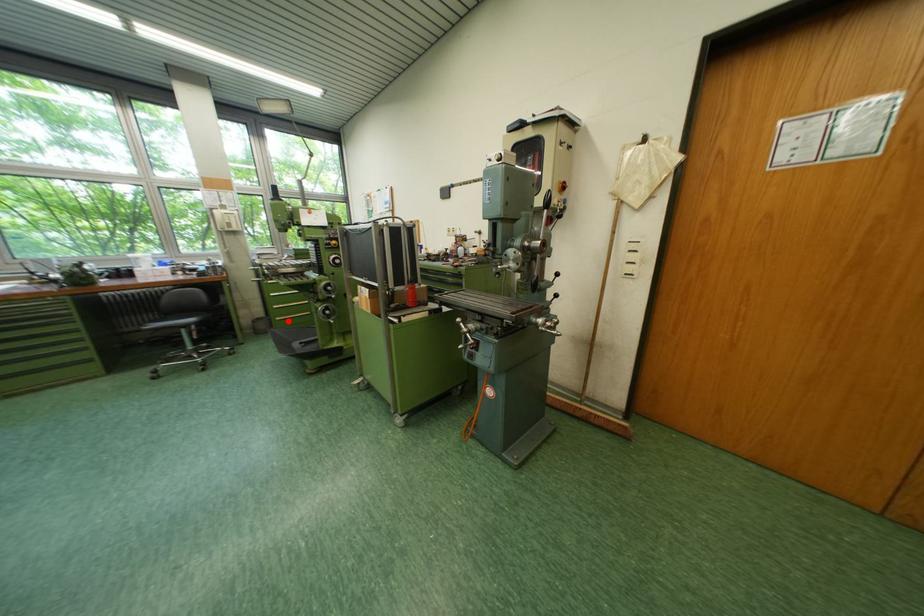
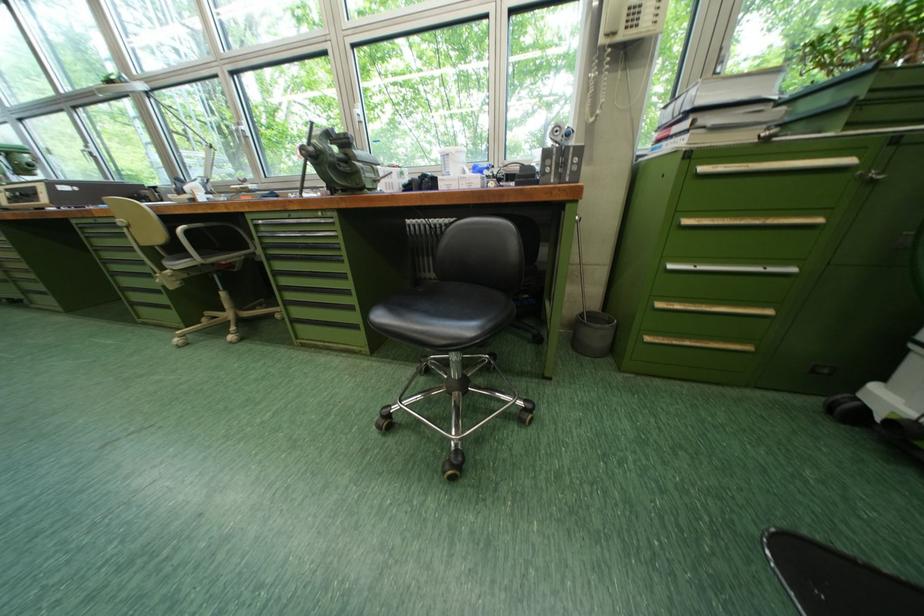
Question: I am providing you with two images of the same scene from different viewpoints. A red point is shown in image1. For the corresponding object point in image2, is it positioned nearer or farther from the camera?

Choices:
 (A) Nearer
 (B) Farther

Answer: (A)